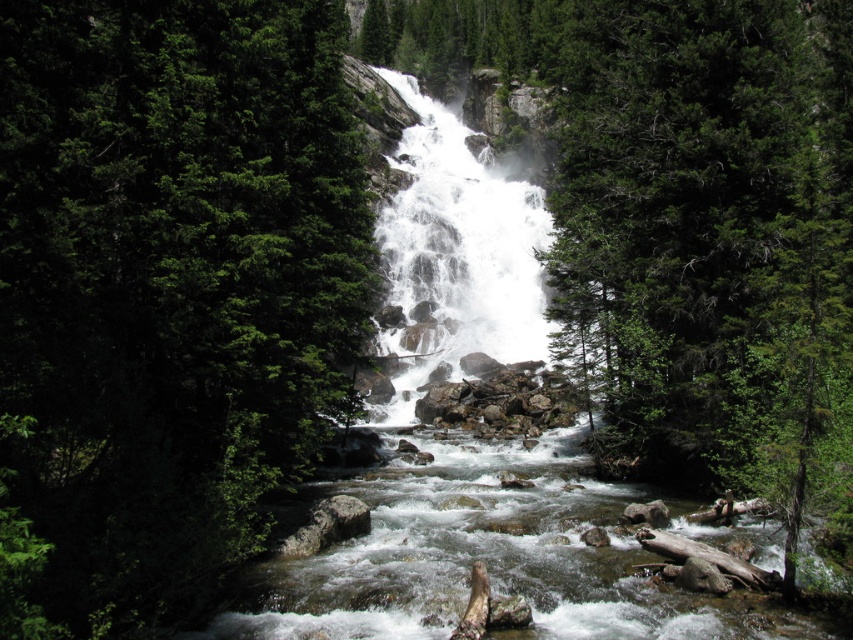
You are a hiker trying to decide which tree to climb for a better view. The green leafy tree at center and the green textured tree at center are both options. Which tree would be narrower in width?

The green leafy tree at center is thinner than the green textured tree at center, so it would be narrower in width.

You are standing at the edge of the river and want to locate the green leafy tree at center. According to the coordinates provided, where should you look relative to your position?

The green leafy tree at center is located at coordinates point (166, 292), which means it is positioned approximately 45.8 percent from the left edge and 19.6 percent from the top edge of the scene. Since you are at the river edge, you should look towards the center area slightly to the right and lower from the top to find it.

You are a hiker standing at the base of the waterfall. You want to place a 9 meter long wooden bridge between the green leafy tree at center and the green textured tree at center. Will the bridge fit between them?

The green leafy tree at center and green textured tree at center are 8.95 meters apart. The bridge is 9 meters long, so it will not fit between them as the distance is slightly shorter than the bridge.